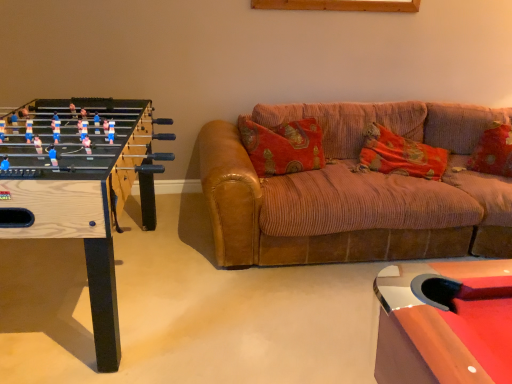
Question: Is velvet-like red pillow at right, the first pillow viewed from the right, bigger or smaller than orange corduroy pillow at center, the 2th pillow positioned from the right?

Choices:
 (A) small
 (B) big

Answer: (A)

Question: From their relative heights in the image, would you say velvet-like red pillow at right, which is the second pillow in left-to-right order, is taller or shorter than orange corduroy pillow at center, the 1th pillow from the left?

Choices:
 (A) tall
 (B) short

Answer: (A)

Question: Which object is the farthest from the brown corduroy couch at center?

Choices:
 (A) orange corduroy pillow at center, the 2th pillow positioned from the right
 (B) wooden foosball table at left
 (C) velvet-like red pillow at right, which is the second pillow in left-to-right order

Answer: (B)

Question: Which is farther from the velvet-like red pillow at right, which is the second pillow in left-to-right order?

Choices:
 (A) brown corduroy couch at center
 (B) wooden foosball table at left
 (C) orange corduroy pillow at center, the 2th pillow positioned from the right

Answer: (B)